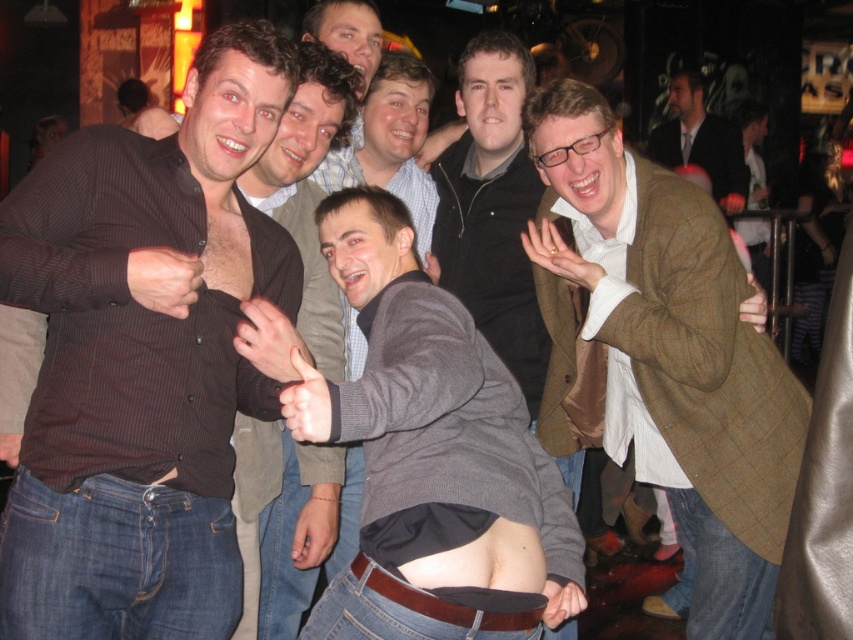
Does brown woolen blazer at right appear on the left side of gray sweater at center?

Incorrect, brown woolen blazer at right is not on the left side of gray sweater at center.

Between brown woolen blazer at right and gray sweater at center, which one appears on the right side from the viewer's perspective?

brown woolen blazer at right is more to the right.

Is point (585, 134) behind point (506, 120)?

No.

You are a GUI agent. You are given a task and a screenshot of the screen. Output one action in this format:
    pyautogui.click(x=<x>, y=<y>)
    Task: Click on the brown woolen blazer at right
    This screenshot has width=853, height=640.
    Given the screenshot: What is the action you would take?
    pyautogui.click(x=666, y=353)

Is point (318, 109) positioned before point (660, 140)?

Yes.

Based on the photo, can you confirm if dark brown shirt at center is positioned to the right of brown woolen blazer at upper right?

No, dark brown shirt at center is not to the right of brown woolen blazer at upper right.

Is point (311, 346) behind point (743, 164)?

No, (311, 346) is in front of (743, 164).

Locate an element on the screen. dark brown shirt at center is located at coordinates (308, 188).

Is gray sweater at center below brown woolen blazer at upper right?

Yes, gray sweater at center is below brown woolen blazer at upper right.

Can you confirm if gray sweater at center is bigger than brown woolen blazer at upper right?

No.

The width and height of the screenshot is (853, 640). What do you see at coordinates (492, 209) in the screenshot?
I see `gray sweater at center` at bounding box center [492, 209].

The height and width of the screenshot is (640, 853). In order to click on gray sweater at center in this screenshot , I will do `click(492, 209)`.